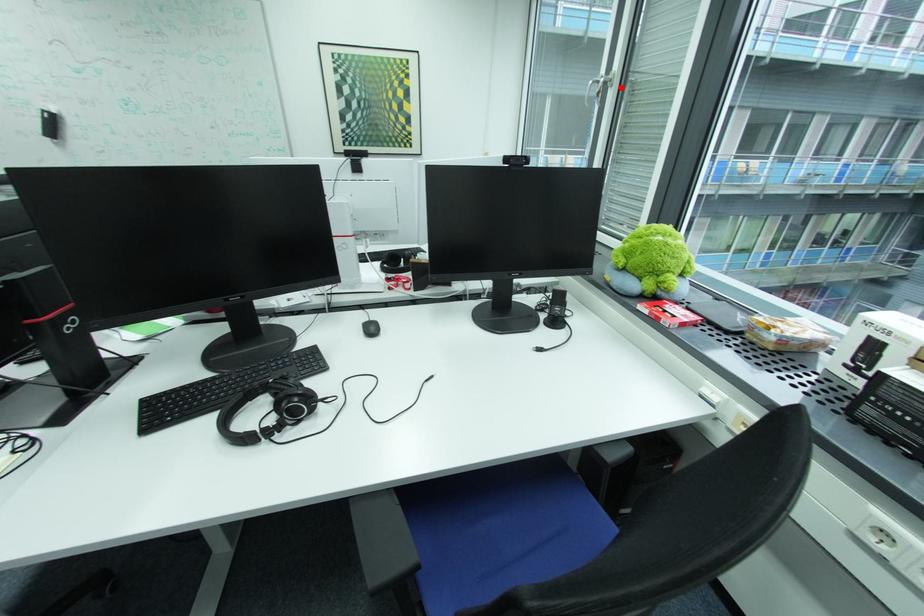
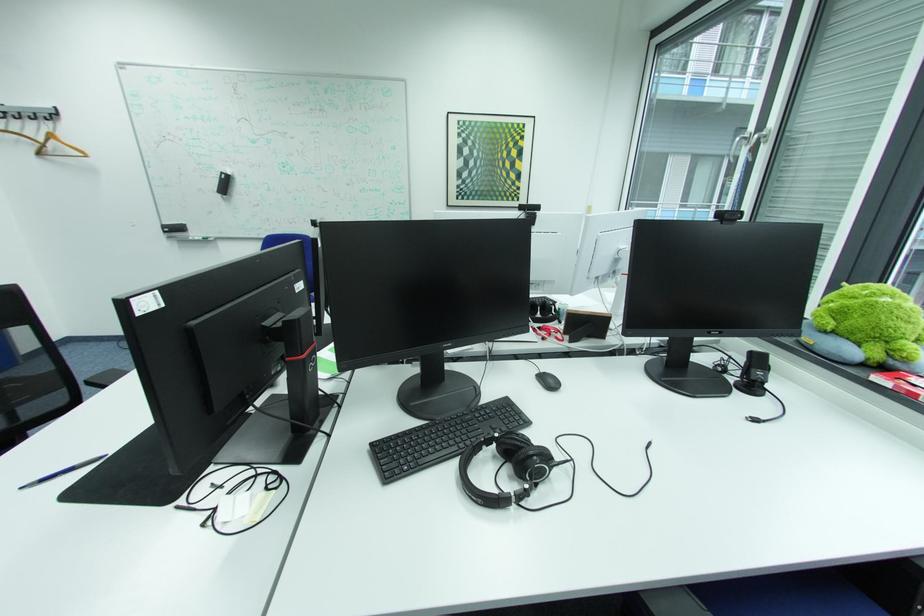
Where in the second image is the point corresponding to the highlighted location from the first image?

(773, 143)